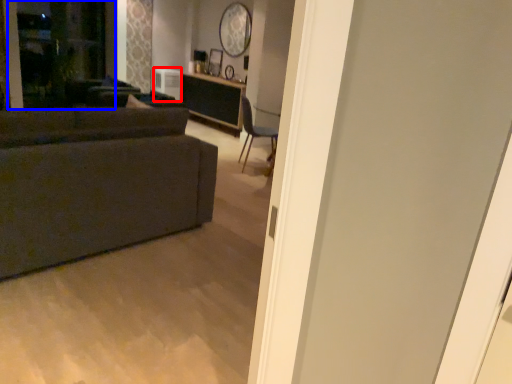
Question: Which object appears farthest to the camera in this image, appliance (highlighted by a red box) or screen door (highlighted by a blue box)?

Choices:
 (A) appliance
 (B) screen door

Answer: (A)